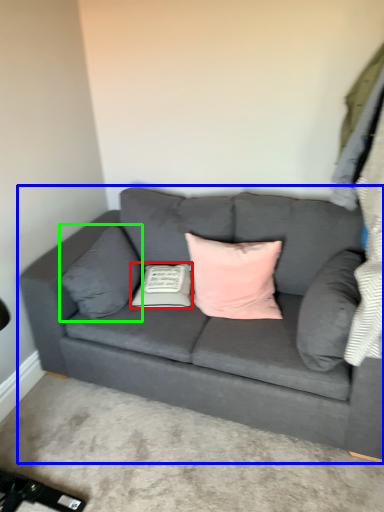
Question: Which object is positioned closest to pillow (highlighted by a red box)? Select from studio couch (highlighted by a blue box) and pillow (highlighted by a green box).

Choices:
 (A) studio couch
 (B) pillow

Answer: (B)